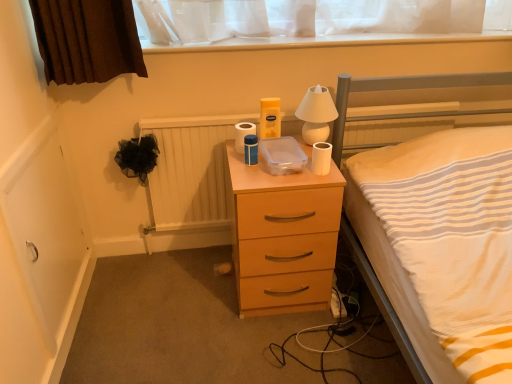
Identify the location of wooden radiator at center. (191, 170).

Describe the element at coordinates (316, 114) in the screenshot. I see `white glossy lamp at upper center` at that location.

This screenshot has width=512, height=384. I want to click on white matte toilet paper at center, arranged as the second toilet paper when viewed from the right, so click(x=243, y=134).

This screenshot has height=384, width=512. I want to click on matte wood chest of drawers at center, so click(x=283, y=237).

Considering the relative positions of wooden radiator at center and white glossy lamp at upper center in the image provided, is wooden radiator at center to the left or to the right of white glossy lamp at upper center?

In the image, wooden radiator at center appears on the left side of white glossy lamp at upper center.

Is wooden radiator at center facing away from white glossy lamp at upper center?

That's not correct — wooden radiator at center is not looking away from white glossy lamp at upper center.

Between wooden radiator at center and white glossy lamp at upper center, which one has more height?

With more height is wooden radiator at center.

The height and width of the screenshot is (384, 512). Find the location of `radiator on the left of the white glossy lamp at upper center`. radiator on the left of the white glossy lamp at upper center is located at coordinates (191, 170).

Between white matte toilet paper at center, which is the 2th toilet paper in front-to-back order, and wooden radiator at center, which one appears on the right side from the viewer's perspective?

wooden radiator at center is more to the right.

Which of these two, white matte toilet paper at center, which is the 1th toilet paper from back to front, or wooden radiator at center, is bigger?

wooden radiator at center is bigger.

In the scene shown: Is white matte toilet paper at center, which is the 2th toilet paper in front-to-back order, touching wooden radiator at center?

No, white matte toilet paper at center, which is the 2th toilet paper in front-to-back order, is not with wooden radiator at center.

From the image's perspective, between white matte toilet paper at center, arranged as the second toilet paper when viewed from the right, and wooden radiator at center, who is located below?

wooden radiator at center, from the image's perspective.

Would you say white striped fabric at center contains matte wood chest of drawers at center?

No, white striped fabric at center does not contain matte wood chest of drawers at center.

At what (x,y) coordinates should I click in order to perform the action: click on chest of drawers behind the white striped fabric at center. Please return your answer as a coordinate pair (x, y). This screenshot has height=384, width=512. Looking at the image, I should click on (283, 237).

Which is more to the left, white striped fabric at center or matte wood chest of drawers at center?

matte wood chest of drawers at center is more to the left.

Considering the sizes of objects white matte toilet paper at right, the second toilet paper viewed from the left, and wooden radiator at center in the image provided, who is shorter, white matte toilet paper at right, the second toilet paper viewed from the left, or wooden radiator at center?

white matte toilet paper at right, the second toilet paper viewed from the left, is shorter.

Considering the sizes of objects white matte toilet paper at right, the second toilet paper viewed from the left, and wooden radiator at center in the image provided, who is thinner, white matte toilet paper at right, the second toilet paper viewed from the left, or wooden radiator at center?

With smaller width is white matte toilet paper at right, the second toilet paper viewed from the left.

Considering the relative sizes of white matte toilet paper at right, which is the second toilet paper in back-to-front order, and wooden radiator at center in the image provided, is white matte toilet paper at right, which is the second toilet paper in back-to-front order, bigger than wooden radiator at center?

No, white matte toilet paper at right, which is the second toilet paper in back-to-front order, is not bigger than wooden radiator at center.

From the image's perspective, which one is positioned lower, white matte toilet paper at right, the 1th toilet paper positioned from the right, or wooden radiator at center?

wooden radiator at center is shown below in the image.

Which object is positioned more to the left, wooden radiator at center or white matte toilet paper at center, which is the 2th toilet paper in front-to-back order?

white matte toilet paper at center, which is the 2th toilet paper in front-to-back order, is more to the left.

In the scene shown: How different are the orientations of wooden radiator at center and white matte toilet paper at center, arranged as the second toilet paper when viewed from the right, in degrees?

They differ by 1.44 degrees in their facing directions.

Can you confirm if wooden radiator at center is wider than white matte toilet paper at center, which is the 2th toilet paper in front-to-back order?

No, wooden radiator at center is not wider than white matte toilet paper at center, which is the 2th toilet paper in front-to-back order.

Can you confirm if wooden radiator at center is taller than white matte toilet paper at center, acting as the first toilet paper starting from the left?

Correct, wooden radiator at center is much taller as white matte toilet paper at center, acting as the first toilet paper starting from the left.

Is white glossy lamp at upper center bigger or smaller than wooden radiator at center?

In the image, white glossy lamp at upper center appears to be smaller than wooden radiator at center.

Does white glossy lamp at upper center have a lesser height compared to wooden radiator at center?

Yes, white glossy lamp at upper center is shorter than wooden radiator at center.

Considering the points (323, 115) and (186, 151), which point is behind, point (323, 115) or point (186, 151)?

The point (186, 151) is farther.

Consider the image. Which of these two, white glossy lamp at upper center or wooden radiator at center, is wider?

With larger width is white glossy lamp at upper center.

The image size is (512, 384). I want to click on the chest of drawers directly beneath the white glossy lamp at upper center (from a real-world perspective), so click(283, 237).

Consider the image. Could you tell me if white glossy lamp at upper center is turned towards matte wood chest of drawers at center?

No, white glossy lamp at upper center does not turn towards matte wood chest of drawers at center.

Does point (321, 130) come farther from viewer compared to point (234, 182)?

Yes, point (321, 130) is farther from viewer.

Identify the location of bedside lamp in front of the wooden radiator at center. Image resolution: width=512 pixels, height=384 pixels. (316, 114).

Identify the location of toilet paper that is the 2nd object above the wooden radiator at center (from a real-world perspective). This screenshot has height=384, width=512. (243, 134).

Estimate the real-world distances between objects in this image. Which object is further from white glossy lamp at upper center, wooden radiator at center or matte wood chest of drawers at center?

wooden radiator at center is positioned further to the anchor white glossy lamp at upper center.

Based on their spatial positions, is matte wood chest of drawers at center or white glossy lamp at upper center closer to white striped fabric at center?

white glossy lamp at upper center lies closer to white striped fabric at center than the other object.

Considering their positions, is white striped fabric at center positioned closer to white matte toilet paper at right, the second toilet paper viewed from the left, than white glossy lamp at upper center?

white glossy lamp at upper center.

From the image, which object appears to be farther from white glossy lamp at upper center, white striped fabric at center or white matte toilet paper at right, the second toilet paper viewed from the left?

Based on the image, white striped fabric at center appears to be further to white glossy lamp at upper center.

In the scene shown: Estimate the real-world distances between objects in this image. Which object is closer to white matte toilet paper at center, which is the 1th toilet paper from back to front, white glossy lamp at upper center or white striped fabric at center?

white glossy lamp at upper center.

Looking at the image, which one is located closer to matte wood chest of drawers at center, white matte toilet paper at right, which ranks as the 1th toilet paper in front-to-back order, or white striped fabric at center?

Among the two, white matte toilet paper at right, which ranks as the 1th toilet paper in front-to-back order, is located nearer to matte wood chest of drawers at center.

Considering their positions, is white matte toilet paper at center, acting as the first toilet paper starting from the left, positioned further to wooden radiator at center than white matte toilet paper at right, the 1th toilet paper positioned from the right?

white matte toilet paper at right, the 1th toilet paper positioned from the right.

Which object lies further to the anchor point matte wood chest of drawers at center, wooden radiator at center or white striped fabric at center?

white striped fabric at center lies further to matte wood chest of drawers at center than the other object.

Find the location of a particular element. The width and height of the screenshot is (512, 384). bedside lamp between white striped fabric at center and wooden radiator at center along the z-axis is located at coordinates tap(316, 114).

Find the location of a particular element. radiator between white matte toilet paper at center, which is the 2th toilet paper in front-to-back order, and matte wood chest of drawers at center from top to bottom is located at coordinates (191, 170).

Where is `toilet paper located between white matte toilet paper at center, which is the 2th toilet paper in front-to-back order, and white glossy lamp at upper center in the left-right direction`? This screenshot has height=384, width=512. toilet paper located between white matte toilet paper at center, which is the 2th toilet paper in front-to-back order, and white glossy lamp at upper center in the left-right direction is located at coordinates (321, 158).

Locate an element on the screen. radiator between white matte toilet paper at center, which is the 1th toilet paper from back to front, and white glossy lamp at upper center is located at coordinates (191, 170).